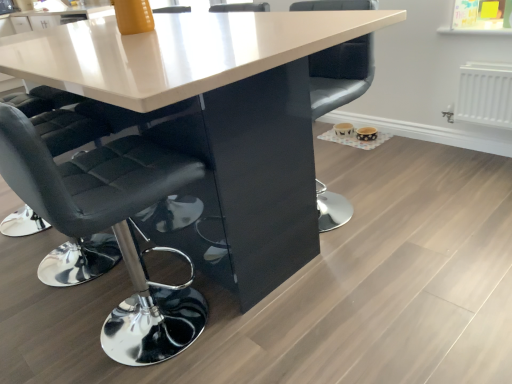
Looking at this image, what is the approximate height of white glossy table at center?

The height of white glossy table at center is 35.80 inches.

Where is `white glossy table at center`? The width and height of the screenshot is (512, 384). white glossy table at center is located at coordinates (177, 52).

What do you see at coordinates (110, 226) in the screenshot?
I see `black leather chair at left, acting as the second chair starting from the right` at bounding box center [110, 226].

This screenshot has height=384, width=512. Find the location of `white glossy table at center`. white glossy table at center is located at coordinates (177, 52).

Considering the relative sizes of black leather chair at center, arranged as the first chair when viewed from the right, and white glossy table at center in the image provided, is black leather chair at center, arranged as the first chair when viewed from the right, smaller than white glossy table at center?

Yes.

Would you say black leather chair at center, which is the second chair in left-to-right order, contains white glossy table at center?

No, white glossy table at center is not surrounded by black leather chair at center, which is the second chair in left-to-right order.

Find the location of a particular element. Image resolution: width=512 pixels, height=384 pixels. chair that appears above the white glossy table at center (from the image's perspective) is located at coordinates 340,74.

From a real-world perspective, which is physically above, black leather chair at center, which is the second chair in left-to-right order, or white glossy table at center?

In real-world perspective, black leather chair at center, which is the second chair in left-to-right order, is above.

Image resolution: width=512 pixels, height=384 pixels. I want to click on table lying in front of the black leather chair at left, acting as the second chair starting from the right, so click(x=177, y=52).

From a real-world perspective, does black leather chair at left, which appears as the 1th chair when viewed from the left, stand above white glossy table at center?

Yes, from a real-world perspective, black leather chair at left, which appears as the 1th chair when viewed from the left, is over white glossy table at center

Is black leather chair at left, which appears as the 1th chair when viewed from the left, next to white glossy table at center and touching it?

No.

Is point (39, 183) positioned after point (283, 207)?

No, (39, 183) is closer to viewer.

Who is bigger, white glossy table at center or black leather chair at left, which appears as the 1th chair when viewed from the left?

white glossy table at center.

Is white glossy table at center inside the boundaries of black leather chair at left, acting as the second chair starting from the right, or outside?

white glossy table at center is located beyond the bounds of black leather chair at left, acting as the second chair starting from the right.

Is white glossy table at center positioned far away from black leather chair at left, which appears as the 1th chair when viewed from the left?

No.

Is white glossy table at center turned away from black leather chair at left, acting as the second chair starting from the right?

That's not correct — white glossy table at center is not looking away from black leather chair at left, acting as the second chair starting from the right.

From the picture: How different are the orientations of black leather chair at center, which is the second chair in left-to-right order, and black leather chair at left, which appears as the 1th chair when viewed from the left, in degrees?

The angular difference between black leather chair at center, which is the second chair in left-to-right order, and black leather chair at left, which appears as the 1th chair when viewed from the left, is 180 degrees.

Which of these two, black leather chair at center, which is the second chair in left-to-right order, or black leather chair at left, acting as the second chair starting from the right, stands taller?

black leather chair at left, acting as the second chair starting from the right, is taller.

Consider the image. In the image, is black leather chair at center, which is the second chair in left-to-right order, on the left side or the right side of black leather chair at left, which appears as the 1th chair when viewed from the left?

From the image, it's evident that black leather chair at center, which is the second chair in left-to-right order, is to the right of black leather chair at left, which appears as the 1th chair when viewed from the left.

From a real-world perspective, is black leather chair at center, which is the second chair in left-to-right order, physically below black leather chair at left, acting as the second chair starting from the right?

Yes, from a real-world perspective, black leather chair at center, which is the second chair in left-to-right order, is below black leather chair at left, acting as the second chair starting from the right.

Looking at the image, does white glossy table at center seem bigger or smaller compared to black leather chair at center, arranged as the first chair when viewed from the right?

white glossy table at center is bigger than black leather chair at center, arranged as the first chair when viewed from the right.

Is white glossy table at center inside the boundaries of black leather chair at center, which is the second chair in left-to-right order, or outside?

white glossy table at center exists outside the volume of black leather chair at center, which is the second chair in left-to-right order.

Can you confirm if white glossy table at center is thinner than black leather chair at center, arranged as the first chair when viewed from the right?

No, white glossy table at center is not thinner than black leather chair at center, arranged as the first chair when viewed from the right.

Are white glossy table at center and black leather chair at center, which is the second chair in left-to-right order, far apart?

No, white glossy table at center is in close proximity to black leather chair at center, which is the second chair in left-to-right order.

Is point (18, 182) behind point (364, 2)?

No, it is in front of (364, 2).

Could black leather chair at center, arranged as the first chair when viewed from the right, be considered to be inside black leather chair at left, acting as the second chair starting from the right?

No.

How different are the orientations of black leather chair at left, which appears as the 1th chair when viewed from the left, and black leather chair at center, which is the second chair in left-to-right order, in degrees?

180 degrees.

Looking at this image, how distant is black leather chair at left, acting as the second chair starting from the right, from black leather chair at center, arranged as the first chair when viewed from the right?

The distance of black leather chair at left, acting as the second chair starting from the right, from black leather chair at center, arranged as the first chair when viewed from the right, is 31.03 inches.

Identify the location of table below the black leather chair at center, which is the second chair in left-to-right order (from the image's perspective). This screenshot has width=512, height=384. (177, 52).

Identify the location of the 1st chair counting from the right of the white glossy table at center. Image resolution: width=512 pixels, height=384 pixels. (110, 226).

Looking at the image, which one is located closer to black leather chair at left, acting as the second chair starting from the right, white glossy table at center or black leather chair at center, arranged as the first chair when viewed from the right?

white glossy table at center.

Estimate the real-world distances between objects in this image. Which object is closer to black leather chair at left, which appears as the 1th chair when viewed from the left, black leather chair at center, arranged as the first chair when viewed from the right, or white glossy table at center?

white glossy table at center.

Which object lies nearer to the anchor point white glossy table at center, black leather chair at left, acting as the second chair starting from the right, or black leather chair at center, which is the second chair in left-to-right order?

Based on the image, black leather chair at left, acting as the second chair starting from the right, appears to be nearer to white glossy table at center.

When comparing their distances from black leather chair at center, which is the second chair in left-to-right order, does white glossy table at center or black leather chair at left, which appears as the 1th chair when viewed from the left, seem closer?

white glossy table at center.

From the image, which object appears to be nearer to black leather chair at center, which is the second chair in left-to-right order, black leather chair at left, acting as the second chair starting from the right, or white glossy table at center?

white glossy table at center lies closer to black leather chair at center, which is the second chair in left-to-right order, than the other object.

From the picture: When comparing their distances from white glossy table at center, does black leather chair at center, arranged as the first chair when viewed from the right, or black leather chair at left, acting as the second chair starting from the right, seem further?

black leather chair at center, arranged as the first chair when viewed from the right, lies further to white glossy table at center than the other object.

At what (x,y) coordinates should I click in order to perform the action: click on chair between white glossy table at center and black leather chair at center, arranged as the first chair when viewed from the right, in the horizontal direction. Please return your answer as a coordinate pair (x, y). The height and width of the screenshot is (384, 512). Looking at the image, I should click on (110, 226).